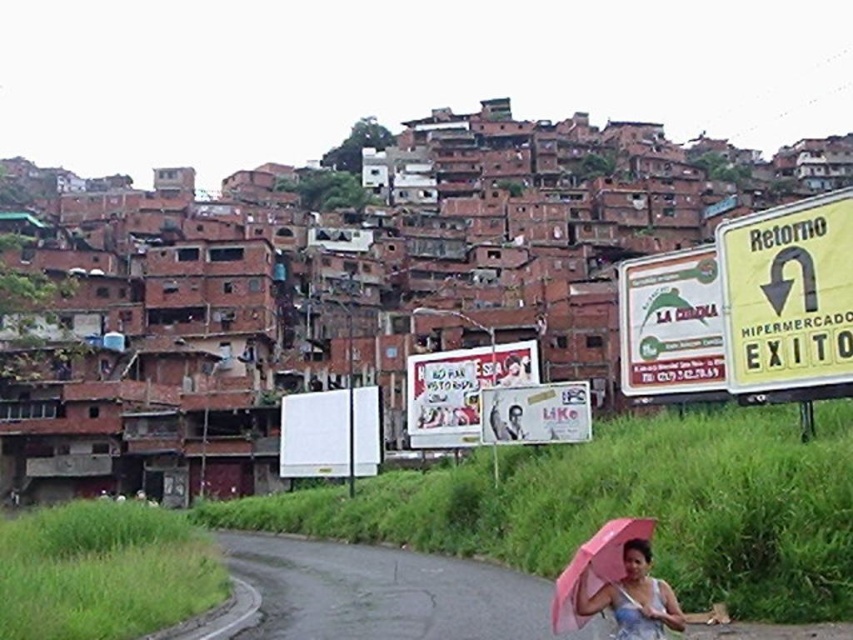
You are a delivery drone with a wingspan of 1 meter. You need to fly from the starting point to the destination. The path requires passing between the brown brick houses at upper left and the pink matte umbrella at lower right. Can you safely navigate this route without hitting either object?

The brown brick houses at upper left might be wider than the pink matte umbrella at lower right, but since the question states they might be wider, there is uncertainty. The drone should avoid this path unless confirmed the width is sufficient.

You are a delivery person who needs to navigate through the hillside community. You see the brown brick houses at upper left and the pink matte umbrella at lower right. Which object is larger in size?

The brown brick houses at upper left is bigger than the pink matte umbrella at lower right according to the description.

You are standing at the center of the road and see the brown brick houses at upper left. Based on their position, which direction should you walk to reach them?

The brown brick houses at upper left are located at point (625, 506), which means they are positioned to the upper left relative to your current position. To reach them, you should walk towards the upper left direction from your current location on the road.